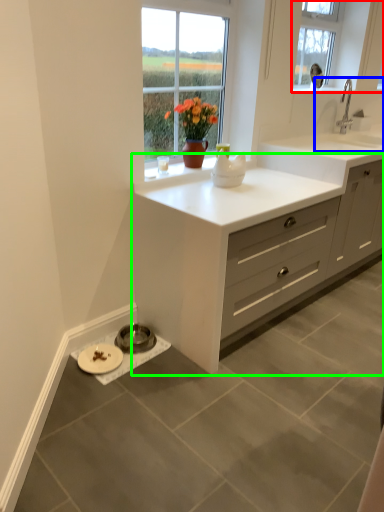
Question: Which is nearer to the window (highlighted by a red box)? sink (highlighted by a blue box) or cabinetry (highlighted by a green box).

Choices:
 (A) sink
 (B) cabinetry

Answer: (A)